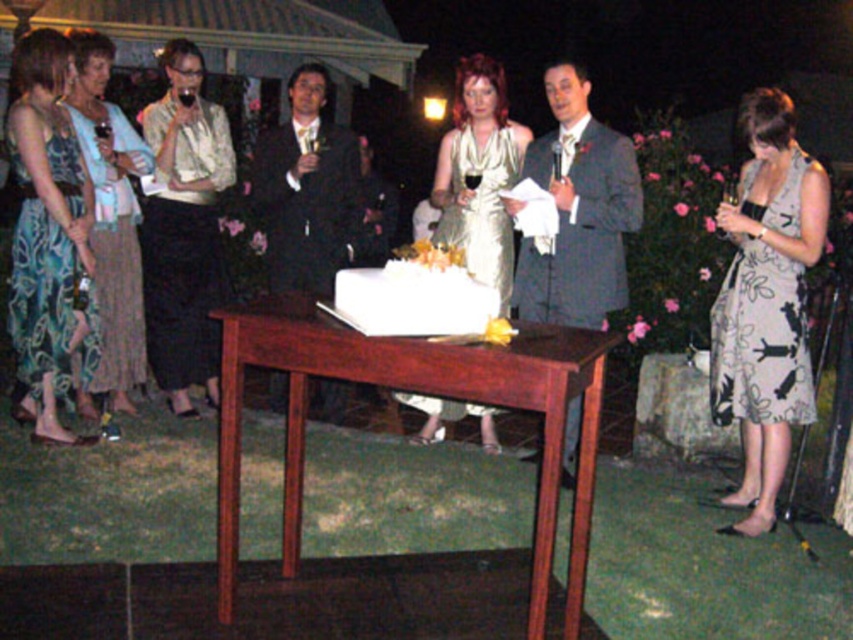
Does blue floral dress at left have a larger size compared to teal floral dress at left?

No.

Looking at this image, does blue floral dress at left have a lesser height compared to teal floral dress at left?

Yes.

Between point (80, 323) and point (107, 264), which one is positioned behind?

The point (107, 264) is more distant.

The width and height of the screenshot is (853, 640). Identify the location of blue floral dress at left. (45, 230).

Between gray textured suit at center and shiny gold dress at center, which one appears on the right side from the viewer's perspective?

gray textured suit at center

Measure the distance between point (590, 259) and camera.

Point (590, 259) and camera are 4.29 meters apart from each other.

Identify the location of gray textured suit at center. (578, 211).

Does point (35, 192) come farther from viewer compared to point (505, 141)?

That is False.

Consider the image. Measure the distance between blue floral dress at left and camera.

3.89 meters

You are a GUI agent. You are given a task and a screenshot of the screen. Output one action in this format:
    pyautogui.click(x=<x>, y=<y>)
    Task: Click on the blue floral dress at left
    
    Given the screenshot: What is the action you would take?
    pyautogui.click(x=45, y=230)